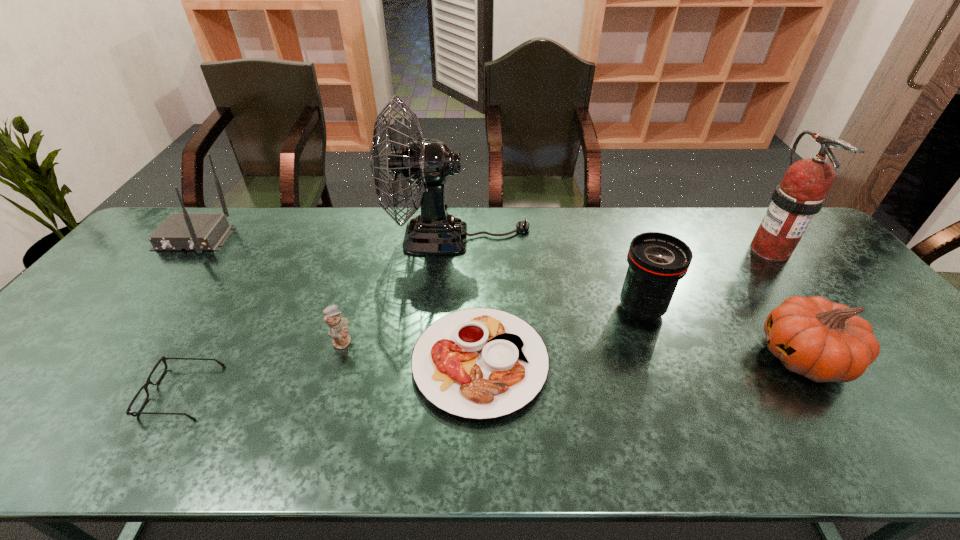
I want to click on vacant region located on the front-facing side of the second object from left to right, so [x=51, y=392].

Find the location of a particular element. The height and width of the screenshot is (540, 960). free space located 0.190m on the front-facing side of the second object from left to right is located at coordinates (68, 392).

Identify the location of fan located in the far edge section of the desktop. Image resolution: width=960 pixels, height=540 pixels. (426, 163).

At what (x,y) coordinates should I click in order to perform the action: click on fire extinguisher that is positioned at the far edge. Please return your answer as a coordinate pair (x, y). The width and height of the screenshot is (960, 540). Looking at the image, I should click on (801, 194).

You are a GUI agent. You are given a task and a screenshot of the screen. Output one action in this format:
    pyautogui.click(x=<x>, y=<y>)
    Task: Click on the router that is at the far edge
    
    Given the screenshot: What is the action you would take?
    pyautogui.click(x=198, y=232)

This screenshot has height=540, width=960. Find the location of `platter present at the near edge`. platter present at the near edge is located at coordinates (478, 363).

Where is `spectacles present at the near edge`? spectacles present at the near edge is located at coordinates (145, 386).

You are a GUI agent. You are given a task and a screenshot of the screen. Output one action in this format:
    pyautogui.click(x=<x>, y=<y>)
    Task: Click on the object present at the left edge
    The width and height of the screenshot is (960, 540).
    Given the screenshot: What is the action you would take?
    pyautogui.click(x=198, y=232)

Locate an element on the screen. This screenshot has width=960, height=540. object located in the right edge section of the desktop is located at coordinates [x=801, y=194].

This screenshot has width=960, height=540. Identify the location of object located in the far left corner section of the desktop. (198, 232).